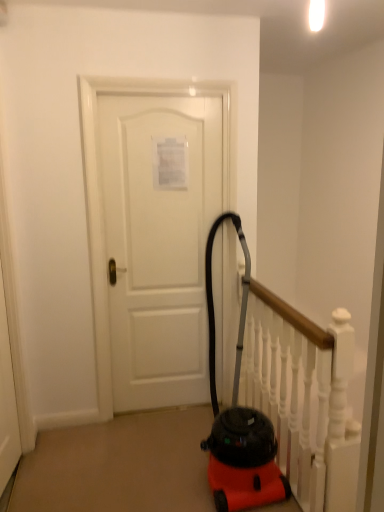
What are the coordinates of `empty space that is ontop of white matte door at center` in the screenshot? It's located at (153, 73).